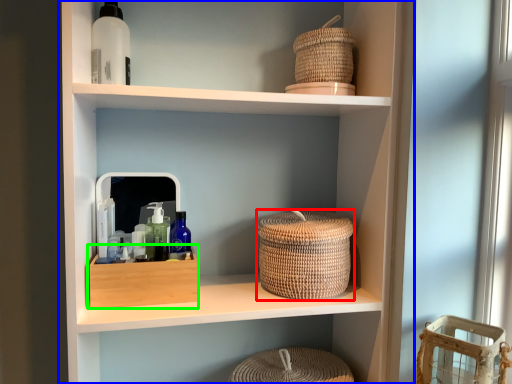
Question: Which is nearer to the basket (highlighted by a red box)? shelf (highlighted by a blue box) or storage box (highlighted by a green box).

Choices:
 (A) shelf
 (B) storage box

Answer: (A)